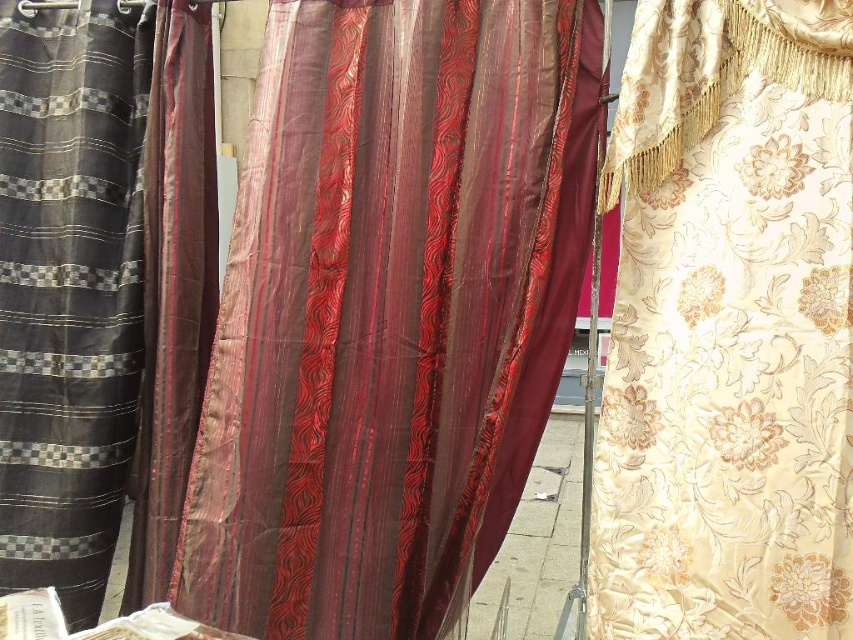
Which is in front, point (474, 394) or point (132, 566)?

Positioned in front is point (474, 394).

Can you confirm if shiny silk curtain at center is positioned above satin-like burgundy curtain at center?

Correct, shiny silk curtain at center is located above satin-like burgundy curtain at center.

What do you see at coordinates (389, 310) in the screenshot? I see `shiny silk curtain at center` at bounding box center [389, 310].

What are the coordinates of `shiny silk curtain at center` in the screenshot? It's located at (389, 310).

Which is below, gold floral fabric at right or satin-like burgundy curtain at center?

gold floral fabric at right is lower down.

Is gold floral fabric at right shorter than satin-like burgundy curtain at center?

Indeed, gold floral fabric at right has a lesser height compared to satin-like burgundy curtain at center.

Where is `gold floral fabric at right`? gold floral fabric at right is located at coordinates (728, 328).

Which is above, gold floral fabric at right or silky striped fabric at left?

Positioned higher is silky striped fabric at left.

Between point (846, 112) and point (109, 65), which one is positioned in front?

Point (846, 112) is in front.

Which is in front, point (624, 243) or point (119, 364)?

Point (624, 243) is in front.

Image resolution: width=853 pixels, height=640 pixels. I want to click on gold floral fabric at right, so click(728, 328).